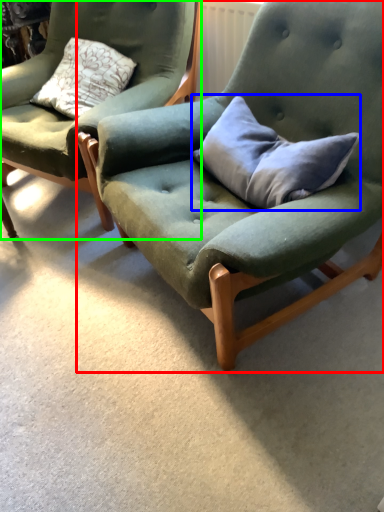
Question: Which object is positioned closest to chair (highlighted by a red box)? Select from pillow (highlighted by a blue box) and chair (highlighted by a green box).

Choices:
 (A) pillow
 (B) chair

Answer: (A)